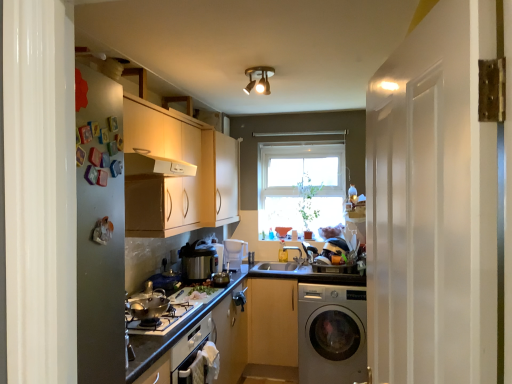
Question: Can you confirm if light wood cabinet at center, arranged as the 1th cabinetry when viewed from the right, is shorter than satin silver rice cooker at center, which appears as the 3th appliance when viewed from the front?

Choices:
 (A) no
 (B) yes

Answer: (A)

Question: Is light wood cabinet at center, the first cabinetry in the bottom-to-top sequence, not close to satin silver rice cooker at center, which appears as the 3th appliance when viewed from the front?

Choices:
 (A) no
 (B) yes

Answer: (A)

Question: From the image's perspective, does light wood cabinet at center, the first cabinetry in the bottom-to-top sequence, appear lower than satin silver rice cooker at center, positioned as the second appliance in back-to-front order?

Choices:
 (A) yes
 (B) no

Answer: (A)

Question: From the image's perspective, would you say light wood cabinet at center, positioned as the second cabinetry in left-to-right order, is positioned over satin silver rice cooker at center, which appears as the 3th appliance when viewed from the front?

Choices:
 (A) no
 (B) yes

Answer: (A)

Question: Is light wood cabinet at center, arranged as the 1th cabinetry when viewed from the right, facing towards satin silver rice cooker at center, which appears as the 3th appliance when viewed from the front?

Choices:
 (A) yes
 (B) no

Answer: (B)

Question: Is light wood cabinet at center, the first cabinetry in the bottom-to-top sequence, looking in the opposite direction of satin silver rice cooker at center, positioned as the second appliance in back-to-front order?

Choices:
 (A) no
 (B) yes

Answer: (A)

Question: Considering the relative sizes of smooth white countertop at center and matte white cabinets at center, the first cabinetry viewed from the left, in the image provided, is smooth white countertop at center bigger than matte white cabinets at center, the first cabinetry viewed from the left,?

Choices:
 (A) yes
 (B) no

Answer: (B)

Question: Considering the relative sizes of smooth white countertop at center and matte white cabinets at center, which is the 2th cabinetry from bottom to top, in the image provided, is smooth white countertop at center thinner than matte white cabinets at center, which is the 2th cabinetry from bottom to top,?

Choices:
 (A) no
 (B) yes

Answer: (A)

Question: From a real-world perspective, is smooth white countertop at center beneath matte white cabinets at center, arranged as the first cabinetry when viewed from the top?

Choices:
 (A) no
 (B) yes

Answer: (B)

Question: Is smooth white countertop at center not inside matte white cabinets at center, arranged as the first cabinetry when viewed from the top?

Choices:
 (A) no
 (B) yes

Answer: (B)

Question: From the image's perspective, is smooth white countertop at center over matte white cabinets at center, which is the 2th cabinetry from bottom to top?

Choices:
 (A) no
 (B) yes

Answer: (A)

Question: Is smooth white countertop at center beside matte white cabinets at center, the first cabinetry viewed from the left?

Choices:
 (A) no
 (B) yes

Answer: (A)

Question: From a real-world perspective, does smooth white countertop at center sit lower than light wood cabinet at center, the first cabinetry in the bottom-to-top sequence?

Choices:
 (A) no
 (B) yes

Answer: (A)